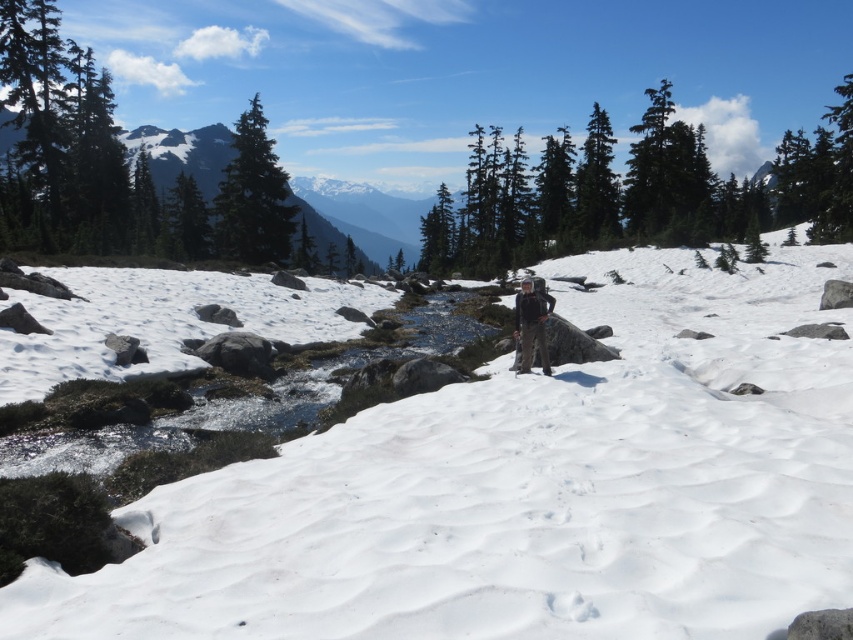
You are an outdoor enthusiast planning to take a photo of the green matte pine at upper left and the matte black backpack at center. Which object should you focus on first if you want to capture both in a single frame without moving the camera?

The green matte pine at upper left is wider than the matte black backpack at center, so you should focus on the green matte pine at upper left first to ensure its entire width fits in the frame before adjusting for the smaller backpack.

You are an outdoor enthusiast planning to take a photo of the green matte pine at upper left and the matte black backpack at center. Since you want both objects to be clearly visible in the frame, which object should you focus on first to ensure proper depth of field?

The green matte pine at upper left is much taller than the matte black backpack at center, so you should focus on the green matte pine at upper left first to ensure both are in focus.